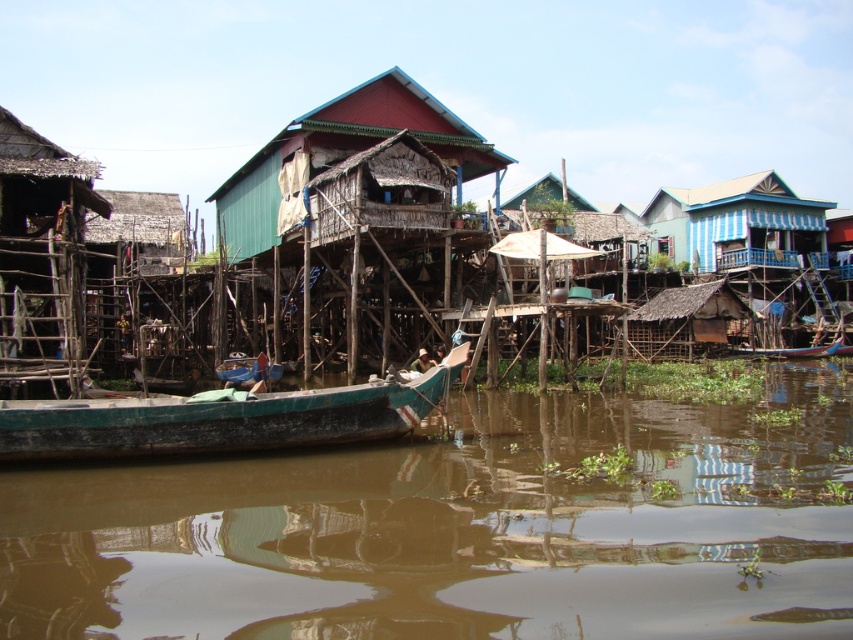
You are standing at the riverside and want to determine which of the two points, point (x=310, y=241) or point (x=793, y=349), is closer to you. Based on the scene, can you identify which point is nearer?

Point (x=310, y=241) is closer to the viewer than point (x=793, y=349).

You are standing at the point with coordinates point (221, 419). Which object are you on?

You are on the green painted wood boat at lower left.

You are standing on the riverside path and want to take a photo of the wooden thatched hut at center and the wooden boat at center. Which object will appear larger in your photo?

The wooden thatched hut at center will appear larger in the photo because it is closer to the viewer than the wooden boat at center.